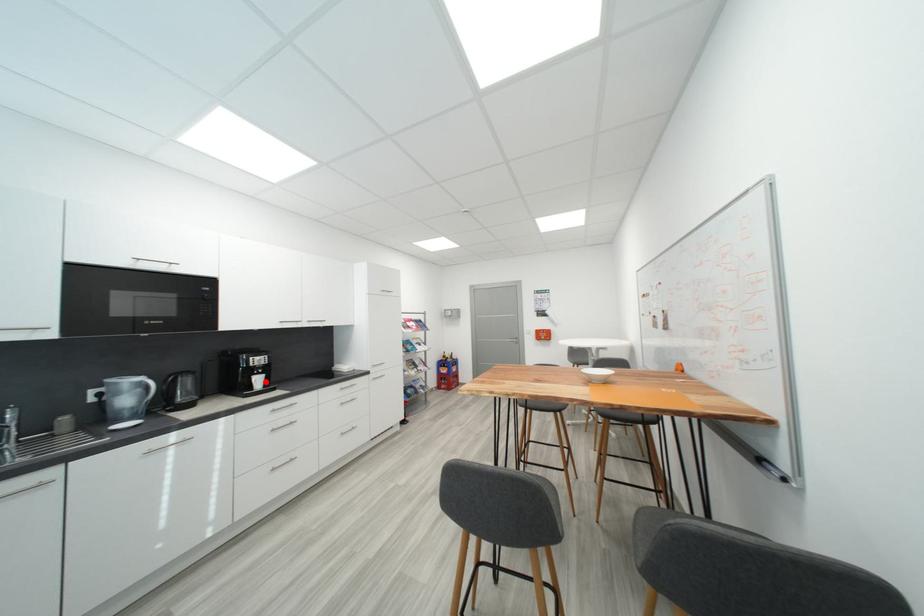
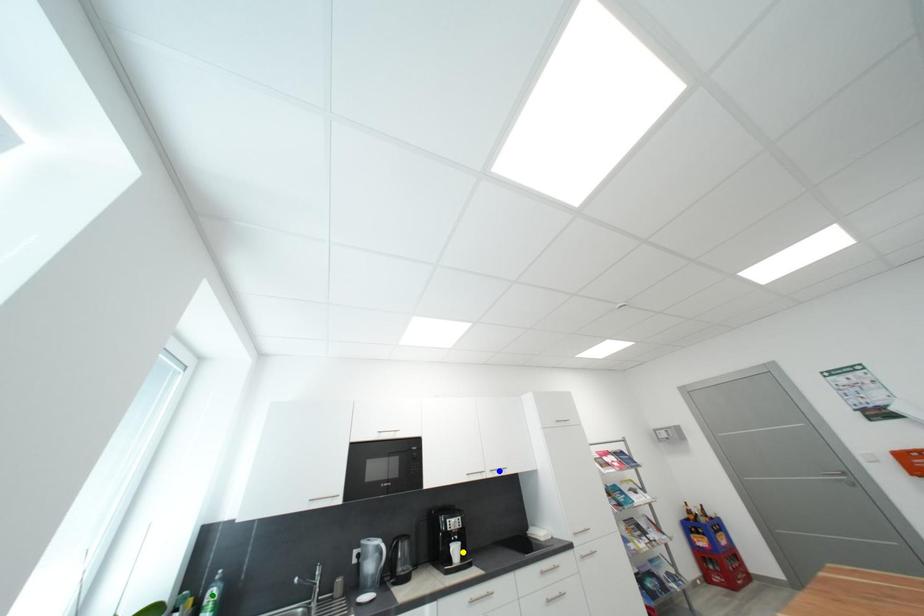
Question: I am providing you with two images of the same scene from different viewpoints. A red point is marked on the first image. You are given multiple points on the second image. In image 2, which mark is for the same physical point as the one in image 1?

Choices:
 (A) blue point
 (B) green point
 (C) yellow point

Answer: (C)